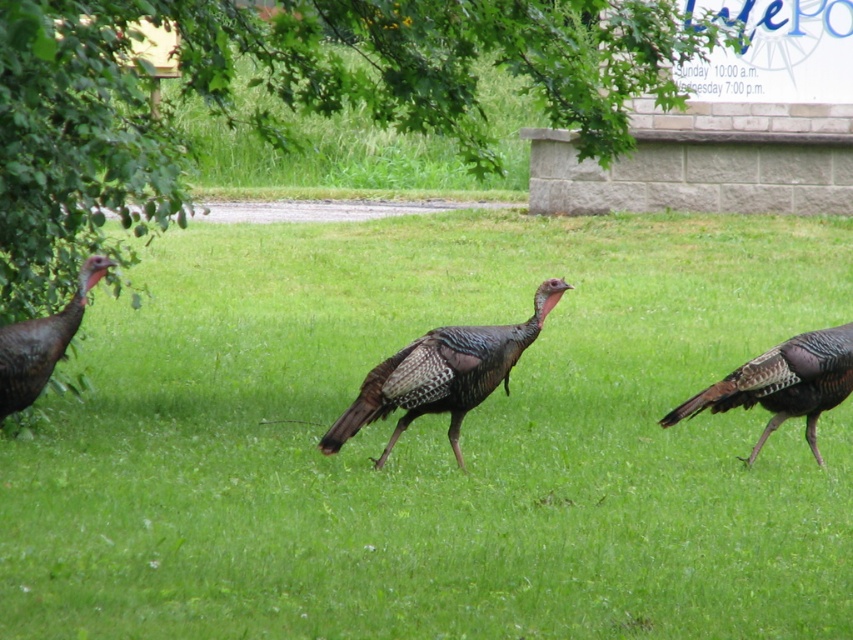
From the picture: You are a wildlife photographer aiming to capture a photo of the brown speckled turkey at center and the shiny brown turkey at center. Which turkey should you focus on first if you want to photograph the taller one?

The brown speckled turkey at center is taller than the shiny brown turkey at center, so you should focus on the brown speckled turkey at center first.